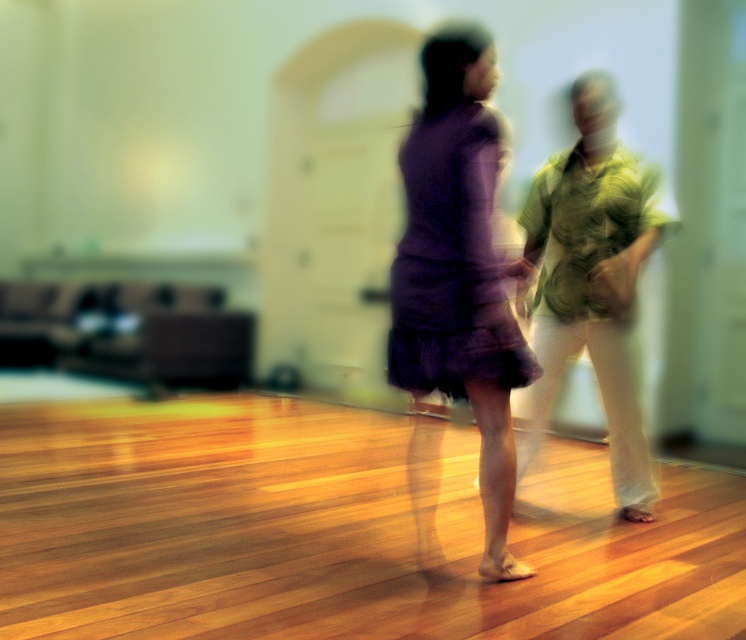
How distant is purple matte dress at center from green textured shirt at right?

purple matte dress at center and green textured shirt at right are 26.51 inches apart from each other.

Which is more to the left, purple matte dress at center or green textured shirt at right?

Positioned to the left is purple matte dress at center.

Image resolution: width=746 pixels, height=640 pixels. I want to click on purple matte dress at center, so click(460, 272).

At what (x,y) coordinates should I click in order to perform the action: click on purple matte dress at center. Please return your answer as a coordinate pair (x, y). This screenshot has height=640, width=746. Looking at the image, I should click on (460, 272).